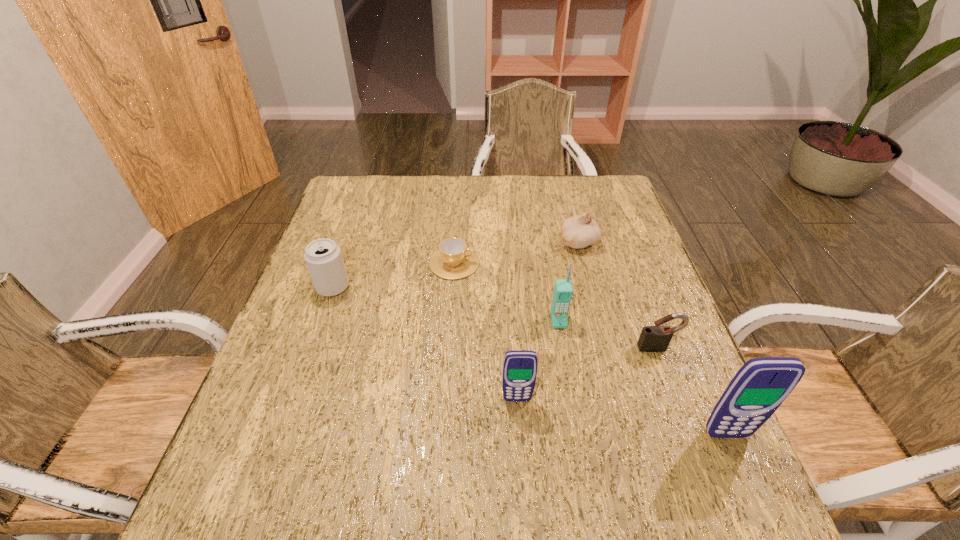
Image resolution: width=960 pixels, height=540 pixels. I want to click on the third nearest object, so click(x=656, y=338).

The image size is (960, 540). In order to click on free space located on the front-facing side of the second nearest object in this screenshot , I will do `click(520, 450)`.

Locate an element on the screen. vacant space located on the front-facing side of the tallest cellular telephone is located at coordinates (740, 465).

You are a GUI agent. You are given a task and a screenshot of the screen. Output one action in this format:
    pyautogui.click(x=<x>, y=<y>)
    Task: Click on the free space located on the left of the garlic
    The image size is (960, 540).
    Given the screenshot: What is the action you would take?
    pyautogui.click(x=466, y=242)

This screenshot has width=960, height=540. I want to click on vacant area situated on the front of the can, so click(x=321, y=323).

This screenshot has height=540, width=960. In order to click on vacant space situated on the keypad of the second cellular telephone from right to left in this screenshot , I will do `click(575, 419)`.

I want to click on free region located with the handle on the side of the cup, so click(x=512, y=264).

Identify the location of free spot located with the keyhole on the front of the padlock. (672, 387).

This screenshot has width=960, height=540. I want to click on object situated at the near edge, so click(761, 385).

At what (x,y) coordinates should I click in order to perform the action: click on object that is at the left edge. Please return your answer as a coordinate pair (x, y). This screenshot has height=540, width=960. Looking at the image, I should click on (323, 257).